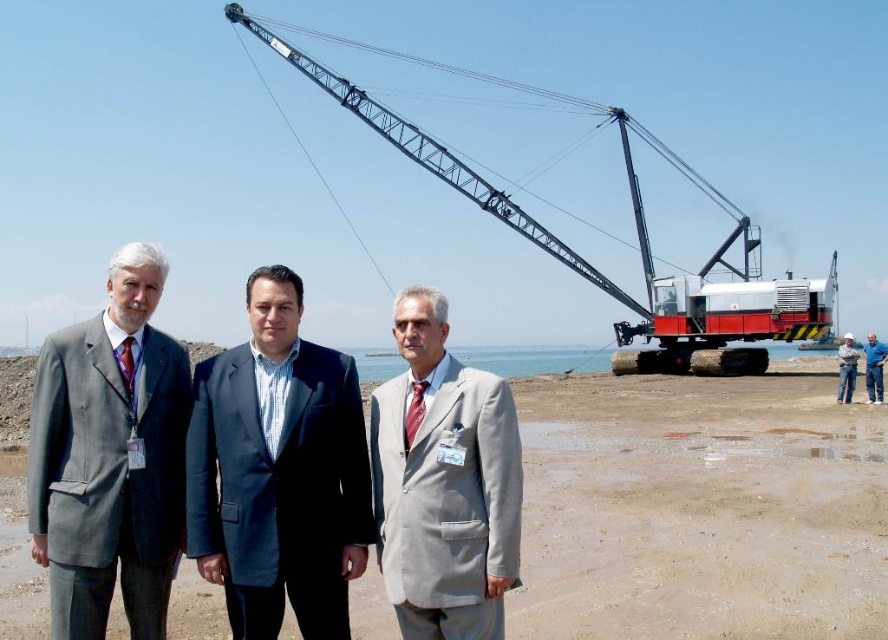
Question: Which point appears closest to the camera in this image?

Choices:
 (A) (883, 360)
 (B) (724, 566)
 (C) (168, 577)

Answer: (C)

Question: Which is farther from the white hard hat at center?

Choices:
 (A) red matte trailer truck at center
 (B) blue fabric shirt at right
 (C) metallic gray crane at upper center

Answer: (C)

Question: Observing the image, what is the correct spatial positioning of brown sand at lower center in reference to metallic gray crane at upper center?

Choices:
 (A) below
 (B) above

Answer: (A)

Question: Is red matte trailer truck at center positioned at the back of white hard hat at center?

Choices:
 (A) yes
 (B) no

Answer: (A)

Question: Is dark blue suit at center bigger than white hard hat at center?

Choices:
 (A) yes
 (B) no

Answer: (B)

Question: Which point is closer to the camera?

Choices:
 (A) brown sand at lower center
 (B) white hard hat at center

Answer: (A)